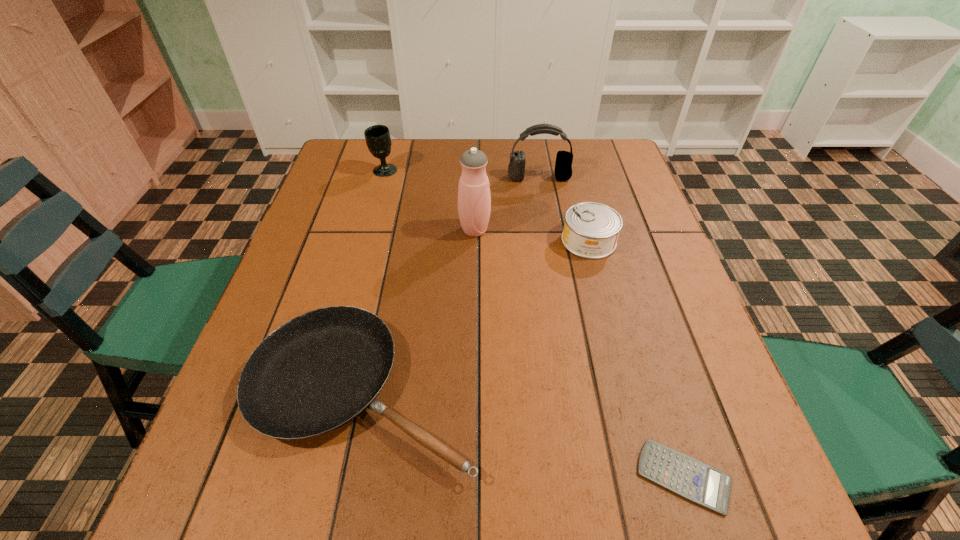
Where is `the tallest object`? the tallest object is located at coordinates (474, 199).

Where is `headset`? headset is located at coordinates (563, 166).

Locate an element on the screen. This screenshot has height=540, width=960. the third tallest object is located at coordinates (378, 139).

What are the coordinates of `the fourth tallest object` in the screenshot? It's located at pos(591,230).

Locate an element on the screen. frying pan is located at coordinates (317, 372).

The height and width of the screenshot is (540, 960). Identify the location of calculator. (692, 479).

The image size is (960, 540). I want to click on free space located on the left of the tallest object, so click(x=423, y=230).

Locate an element on the screen. The height and width of the screenshot is (540, 960). free space located on the headband of the headset is located at coordinates (543, 204).

Where is `vacant space located 0.050m on the left of the third tallest object`? vacant space located 0.050m on the left of the third tallest object is located at coordinates (355, 171).

Image resolution: width=960 pixels, height=540 pixels. Identify the location of free space located 0.100m on the front of the can. [x=602, y=291].